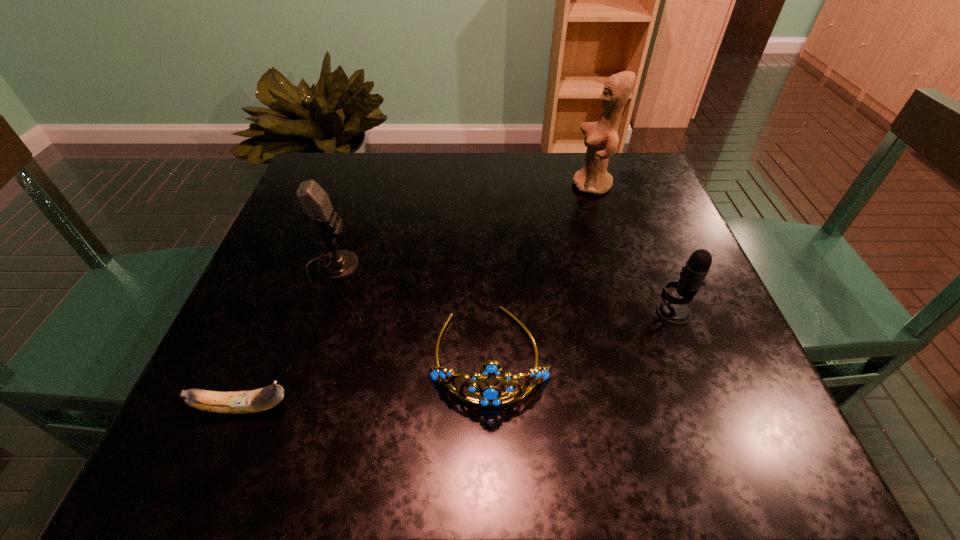
Locate which object ranks third in proximity to the shortest object. Please provide its 2D coordinates. Your answer should be formatted as a tuple, i.e. [(x, y)], where the tuple contains the x and y coordinates of a point satisfying the conditions above.

[(673, 310)]

You are a GUI agent. You are given a task and a screenshot of the screen. Output one action in this format:
    pyautogui.click(x=<x>, y=<y>)
    Task: Click on the object identified as the closest to the right microphone
    
    Given the screenshot: What is the action you would take?
    [490, 395]

Locate an element on the screen. The height and width of the screenshot is (540, 960). free space that satisfies the following two spatial constraints: 1. on the front-facing side of the figurine; 2. on the front-facing side of the fourth tallest object is located at coordinates (644, 355).

This screenshot has width=960, height=540. I want to click on vacant area that satisfies the following two spatial constraints: 1. on the front-facing side of the third tallest object; 2. on the left side of the second tallest object, so click(317, 312).

I want to click on vacant space that satisfies the following two spatial constraints: 1. on the front-facing side of the farthest object; 2. on the left side of the shorter microphone, so click(632, 312).

Identify the location of vacant area in the image that satisfies the following two spatial constraints: 1. on the front-facing side of the farthest object; 2. on the front-facing side of the tiara. (644, 355).

Find the location of a particular element. The image size is (960, 540). vacant point that satisfies the following two spatial constraints: 1. on the front-facing side of the farthest object; 2. on the right side of the right microphone is located at coordinates (632, 312).

You are a GUI agent. You are given a task and a screenshot of the screen. Output one action in this format:
    pyautogui.click(x=<x>, y=<y>)
    Task: Click on the vacant area that satisfies the following two spatial constraints: 1. on the front-facing side of the left microphone; 2. on the back side of the nearer microphone
    This screenshot has width=960, height=540.
    Given the screenshot: What is the action you would take?
    pyautogui.click(x=317, y=312)

Where is `vacant space that satisfies the following two spatial constraints: 1. on the front-facing side of the farthest object; 2. on the left side of the right microphone`? vacant space that satisfies the following two spatial constraints: 1. on the front-facing side of the farthest object; 2. on the left side of the right microphone is located at coordinates (632, 312).

Find the location of `blank area in the image that satisfies the following two spatial constraints: 1. on the front-facing side of the tallest object; 2. on the front-facing side of the tiara`. blank area in the image that satisfies the following two spatial constraints: 1. on the front-facing side of the tallest object; 2. on the front-facing side of the tiara is located at coordinates (644, 355).